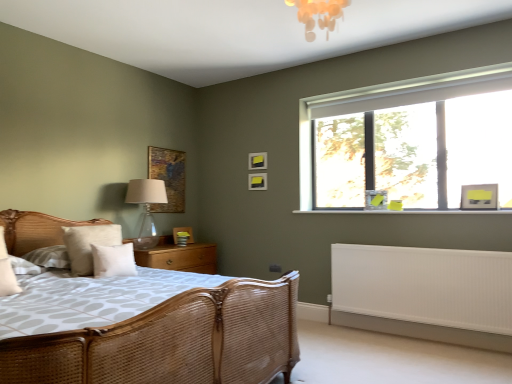
Question: Is the position of white ribbed radiator at lower right less distant than that of wooden textured picture frame at upper center, which appears as the 4th picture frame when viewed from the back?

Choices:
 (A) yes
 (B) no

Answer: (A)

Question: Does white ribbed radiator at lower right have a greater height compared to wooden textured picture frame at upper center, which is the fifth picture frame from right to left?

Choices:
 (A) no
 (B) yes

Answer: (B)

Question: Is white ribbed radiator at lower right next to wooden textured picture frame at upper center, which is the fifth picture frame from right to left?

Choices:
 (A) no
 (B) yes

Answer: (A)

Question: Is white ribbed radiator at lower right at the left side of wooden textured picture frame at upper center, which appears as the 4th picture frame when viewed from the back?

Choices:
 (A) yes
 (B) no

Answer: (B)

Question: Would you consider white ribbed radiator at lower right to be distant from wooden textured picture frame at upper center, which is the fifth picture frame from right to left?

Choices:
 (A) no
 (B) yes

Answer: (B)

Question: Considering the positions of white ribbed radiator at lower right and wooden picture frame at lower center, which is counted as the 1th picture frame, starting from the back, in the image, is white ribbed radiator at lower right taller or shorter than wooden picture frame at lower center, which is counted as the 1th picture frame, starting from the back,?

Choices:
 (A) short
 (B) tall

Answer: (B)

Question: In the image, is white ribbed radiator at lower right positioned in front of or behind wooden picture frame at lower center, which appears as the fifth picture frame when viewed from the front?

Choices:
 (A) behind
 (B) front

Answer: (B)

Question: In terms of width, does white ribbed radiator at lower right look wider or thinner when compared to wooden picture frame at lower center, the second picture frame positioned from the left?

Choices:
 (A) thin
 (B) wide

Answer: (B)

Question: From the image's perspective, relative to wooden picture frame at lower center, which is counted as the 1th picture frame, starting from the back, is white ribbed radiator at lower right above or below?

Choices:
 (A) below
 (B) above

Answer: (A)

Question: Would you say wooden picture frame at lower center, the 4th picture frame positioned from the right, is inside or outside woven rattan bed at left?

Choices:
 (A) inside
 (B) outside

Answer: (B)

Question: Relative to woven rattan bed at left, is wooden picture frame at lower center, the second picture frame positioned from the left, in front or behind?

Choices:
 (A) front
 (B) behind

Answer: (B)

Question: Looking at the image, does wooden picture frame at lower center, the second picture frame positioned from the left, seem bigger or smaller compared to woven rattan bed at left?

Choices:
 (A) big
 (B) small

Answer: (B)

Question: Considering the positions of wooden picture frame at lower center, the second picture frame positioned from the left, and woven rattan bed at left in the image, is wooden picture frame at lower center, the second picture frame positioned from the left, wider or thinner than woven rattan bed at left?

Choices:
 (A) wide
 (B) thin

Answer: (B)

Question: Considering the positions of translucent glass table lamp at left and wooden at left in the image, is translucent glass table lamp at left taller or shorter than wooden at left?

Choices:
 (A) tall
 (B) short

Answer: (A)

Question: Would you say translucent glass table lamp at left is inside or outside wooden at left?

Choices:
 (A) outside
 (B) inside

Answer: (A)